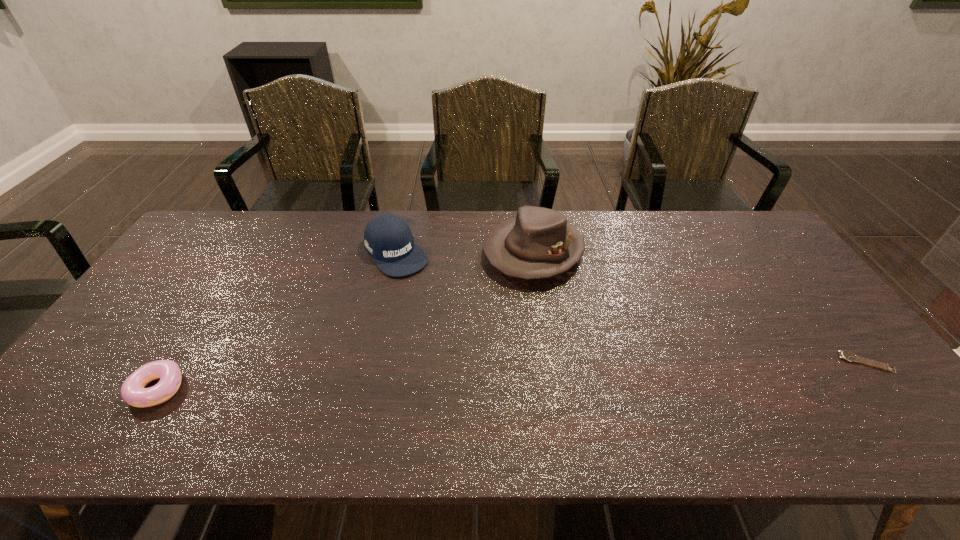
At what (x,y) coordinates should I click in order to perform the action: click on blank space located on the decorative side of the tallest object. Please return your answer as a coordinate pair (x, y). The width and height of the screenshot is (960, 540). Looking at the image, I should click on (436, 364).

The height and width of the screenshot is (540, 960). I want to click on blank space located 0.210m on the decorative side of the tallest object, so click(469, 327).

Locate an element on the screen. The image size is (960, 540). free space located on the decorative side of the tallest object is located at coordinates (469, 327).

This screenshot has height=540, width=960. What are the coordinates of `free space located 0.340m on the front-facing side of the third shortest object` in the screenshot? It's located at (472, 346).

This screenshot has height=540, width=960. In order to click on blank space located on the front-facing side of the third shortest object in this screenshot , I will do [x=481, y=356].

Locate an element on the screen. The image size is (960, 540). blank space located 0.320m on the front-facing side of the third shortest object is located at coordinates (468, 341).

Identify the location of hat positioned at the far edge. (538, 243).

This screenshot has height=540, width=960. I want to click on baseball cap present at the far edge, so click(388, 239).

Where is `doughnut that is at the near edge`? doughnut that is at the near edge is located at coordinates (133, 392).

Locate an element on the screen. The width and height of the screenshot is (960, 540). watch situated at the near edge is located at coordinates (846, 355).